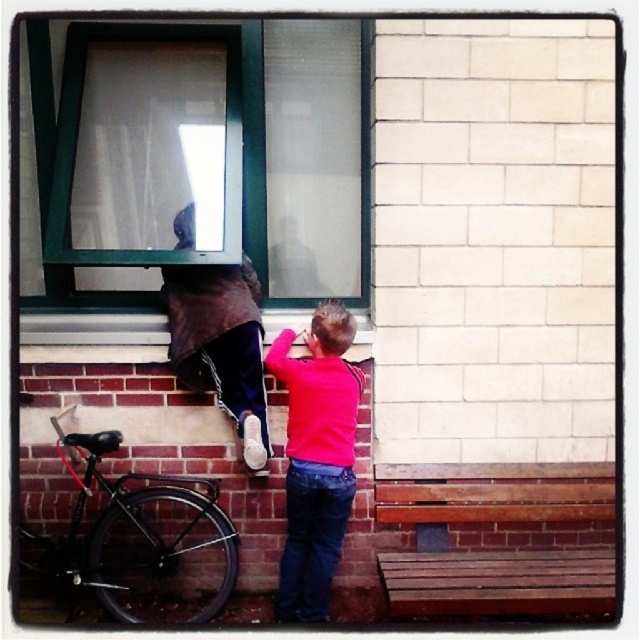
Question: Which point is farther to the camera?

Choices:
 (A) (216, 253)
 (B) (115, 429)

Answer: (B)

Question: Which point is farther to the camera?

Choices:
 (A) green frame glass window at upper center
 (B) brown fabric at upper center
 (C) pink matte sweater at center
 (D) black matte bicycle at lower left

Answer: (B)

Question: Where is black matte bicycle at lower left located in relation to pink matte sweater at center in the image?

Choices:
 (A) below
 (B) above

Answer: (A)

Question: Which point is farther to the camera?

Choices:
 (A) (140, 109)
 (B) (240, 301)
 (C) (326, 573)
 (D) (145, 524)

Answer: (A)

Question: Is green frame glass window at upper center below pink matte sweater at center?

Choices:
 (A) yes
 (B) no

Answer: (B)

Question: Can you confirm if pink matte sweater at center is thinner than brown fabric at upper center?

Choices:
 (A) no
 (B) yes

Answer: (B)